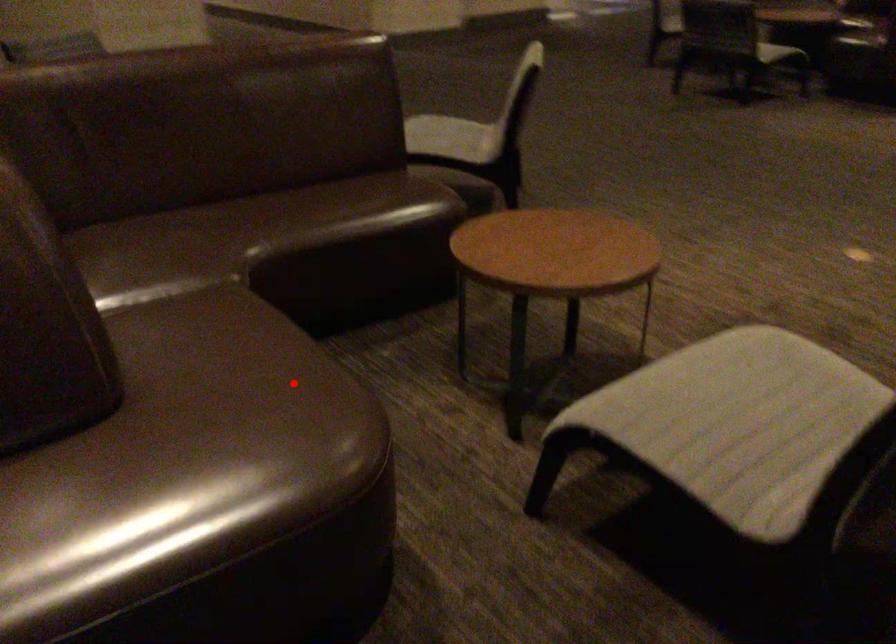
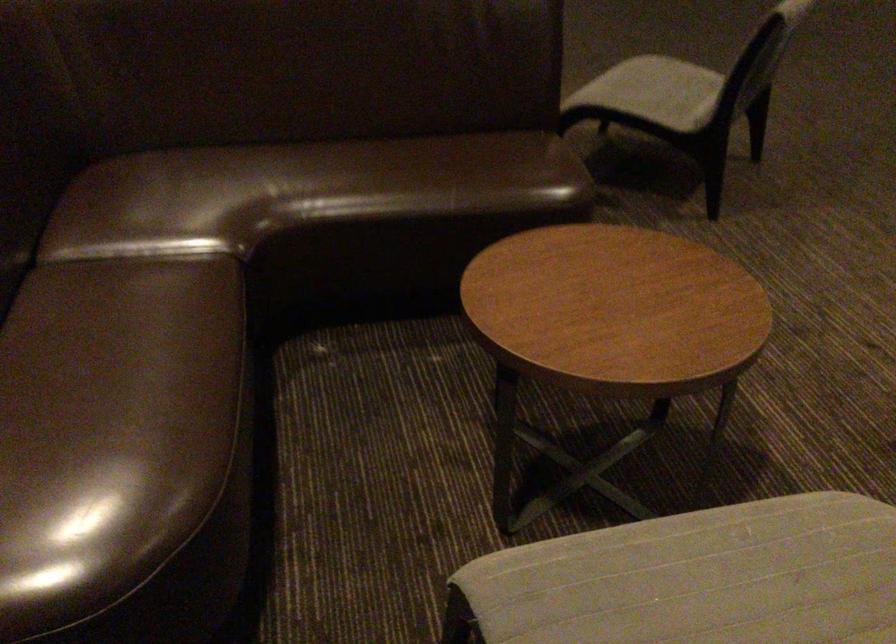
Question: I am providing you with two images of the same scene from different viewpoints. Given a red point in image1, look at the same physical point in image2. Is it:

Choices:
 (A) Closer to the viewpoint
 (B) Farther from the viewpoint

Answer: (A)